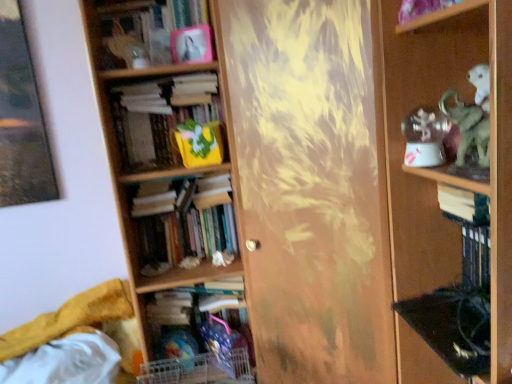
Question: Should I look upward or downward to see yellow fabric bag at center-left, which appears as the second book when viewed from the top?

Choices:
 (A) down
 (B) up

Answer: (B)

Question: Which direction should I rotate to face hardcover books at center, which appears as the 2th book when ordered from the bottom, — up or down?

Choices:
 (A) down
 (B) up

Answer: (A)

Question: Considering the relative sizes of wooden shelf at right and hardcover book at lower center, the 1th book in the bottom-to-top sequence, in the image provided, is wooden shelf at right taller than hardcover book at lower center, the 1th book in the bottom-to-top sequence,?

Choices:
 (A) no
 (B) yes

Answer: (B)

Question: Is wooden shelf at right to the right of hardcover book at lower center, placed as the fifth book when sorted from top to bottom, from the viewer's perspective?

Choices:
 (A) yes
 (B) no

Answer: (A)

Question: From a real-world perspective, is wooden shelf at right under hardcover book at lower center, placed as the fifth book when sorted from top to bottom?

Choices:
 (A) yes
 (B) no

Answer: (B)

Question: Is wooden shelf at right not close to hardcover book at lower center, placed as the fifth book when sorted from top to bottom?

Choices:
 (A) yes
 (B) no

Answer: (B)

Question: Is wooden shelf at right positioned beyond the bounds of hardcover book at lower center, placed as the fifth book when sorted from top to bottom?

Choices:
 (A) yes
 (B) no

Answer: (A)

Question: Does wooden shelf at right come in front of hardcover book at lower center, the 1th book in the bottom-to-top sequence?

Choices:
 (A) no
 (B) yes

Answer: (B)

Question: Is white paper book at right, placed as the 3th book when sorted from top to bottom, aimed at hardcover books at center, which is the fourth book from top to bottom?

Choices:
 (A) no
 (B) yes

Answer: (A)

Question: Is white paper book at right, placed as the 3th book when sorted from top to bottom, located outside hardcover books at center, which is the fourth book from top to bottom?

Choices:
 (A) yes
 (B) no

Answer: (A)

Question: Is white paper book at right, marked as the third book in a bottom-to-top arrangement, smaller than hardcover books at center, which is the fourth book from top to bottom?

Choices:
 (A) no
 (B) yes

Answer: (B)

Question: From the image's perspective, is white paper book at right, marked as the third book in a bottom-to-top arrangement, beneath hardcover books at center, which is the fourth book from top to bottom?

Choices:
 (A) no
 (B) yes

Answer: (A)

Question: From a real-world perspective, is white paper book at right, placed as the 3th book when sorted from top to bottom, positioned under hardcover books at center, which appears as the 2th book when ordered from the bottom, based on gravity?

Choices:
 (A) no
 (B) yes

Answer: (A)

Question: Is white paper book at right, marked as the third book in a bottom-to-top arrangement, further to the viewer compared to hardcover books at center, which appears as the 2th book when ordered from the bottom?

Choices:
 (A) no
 (B) yes

Answer: (A)

Question: Does matte pink photo frame at upper center, marked as the 1th book in a top-to-bottom arrangement, appear on the right side of white paper book at right, marked as the third book in a bottom-to-top arrangement?

Choices:
 (A) no
 (B) yes

Answer: (A)